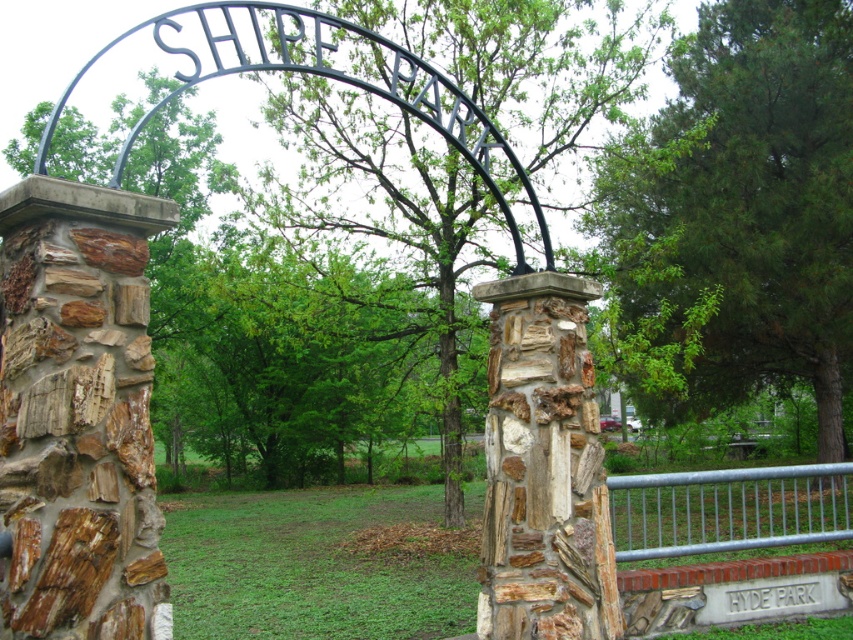
Question: In this image, where is brown stone pillar at left located relative to rustic stone pillar at center?

Choices:
 (A) below
 (B) above

Answer: (B)

Question: Which of the following is the farthest from the observer?

Choices:
 (A) (514, 636)
 (B) (3, 632)
 (C) (735, 173)
 (D) (718, 490)

Answer: (D)

Question: Does rustic stone pillar at center have a larger size compared to galvanized metal fence at lower right?

Choices:
 (A) yes
 (B) no

Answer: (B)

Question: Which object is closer to the camera taking this photo?

Choices:
 (A) brown stone pillar at left
 (B) galvanized metal fence at lower right
 (C) rustic stone pillar at center

Answer: (A)

Question: Which point appears closest to the camera in this image?

Choices:
 (A) (517, 547)
 (B) (758, 234)
 (C) (15, 236)

Answer: (C)

Question: Is rustic stone pillar at center smaller than galvanized metal fence at lower right?

Choices:
 (A) yes
 (B) no

Answer: (A)